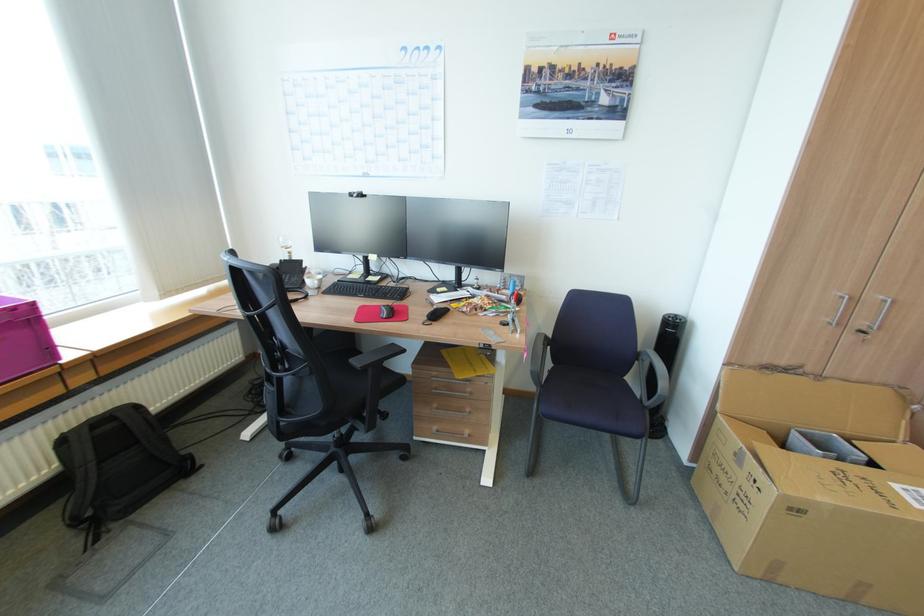
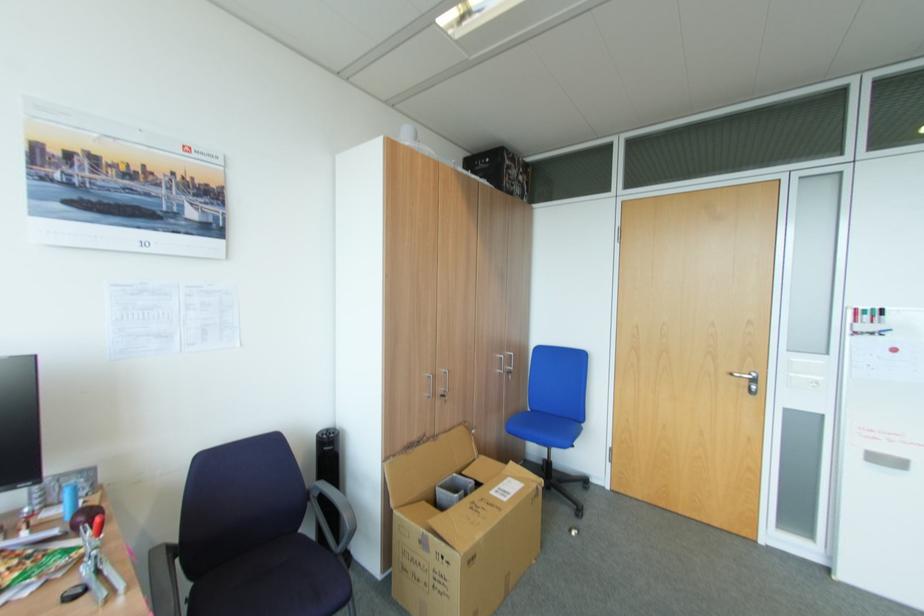
Where in the second image is the point corresponding to [515,315] from the first image?

(91, 569)